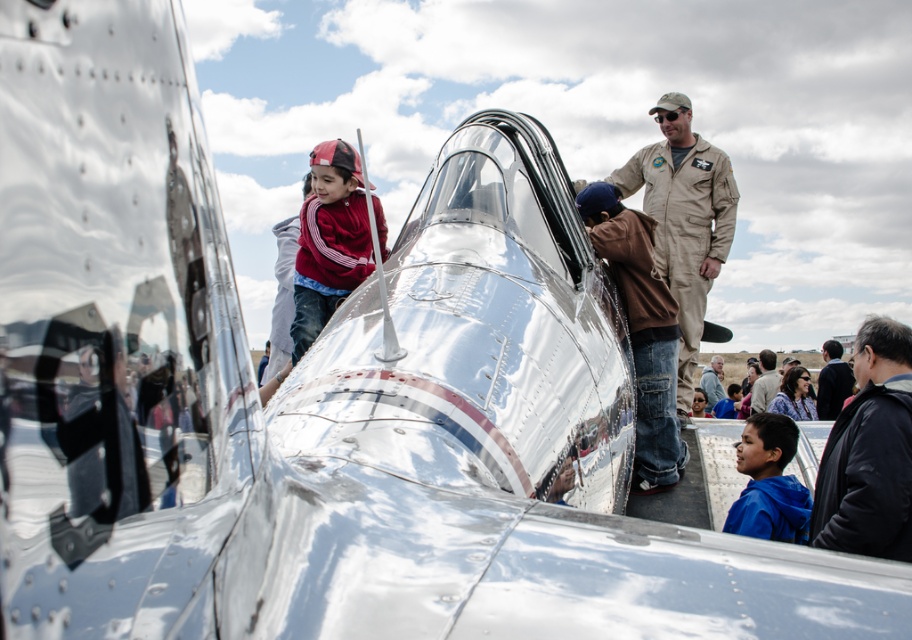
You are a photographer at the airshow who needs to capture a photo of both the khaki uniform at center and the dark gray jacket at lower right in the same frame. The camera you are using has a maximum focus range of 5 meters. Will you be able to include both subjects in the photo without moving your position?

The khaki uniform at center is 5.56 meters away from the dark gray jacket at lower right. Since the distance between them exceeds the camera maximum focus range of 5 meters, you will not be able to capture both subjects in the same frame without moving closer or adjusting your position.

You are organizing a photo shoot and need to position two people in the scene. The khaki uniform at center and the dark gray jacket at lower right must be included. Which person should you place closer to the camera to ensure both are visible clearly in the photo?

The khaki uniform at center should be placed closer to the camera because it has a larger size compared to the dark gray jacket at lower right, ensuring both are visible clearly in the photo.

You are a photographer at the airshow trying to take a photo of the dark brown leather jacket at lower right. However, the khaki uniform at center is blocking your view. Can you move around to the right side to get an unobstructed shot?

The khaki uniform at center is in front of the dark brown leather jacket at lower right, so moving to the right side might allow you to see around the khaki uniform at center and capture the dark brown leather jacket at lower right without obstruction.